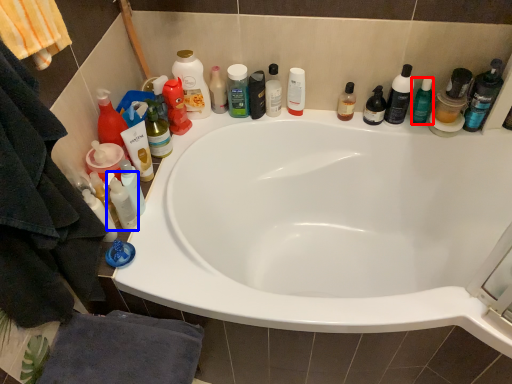
Question: Which object appears farthest to the camera in this image, toiletry (highlighted by a red box) or mouthwash (highlighted by a blue box)?

Choices:
 (A) toiletry
 (B) mouthwash

Answer: (A)